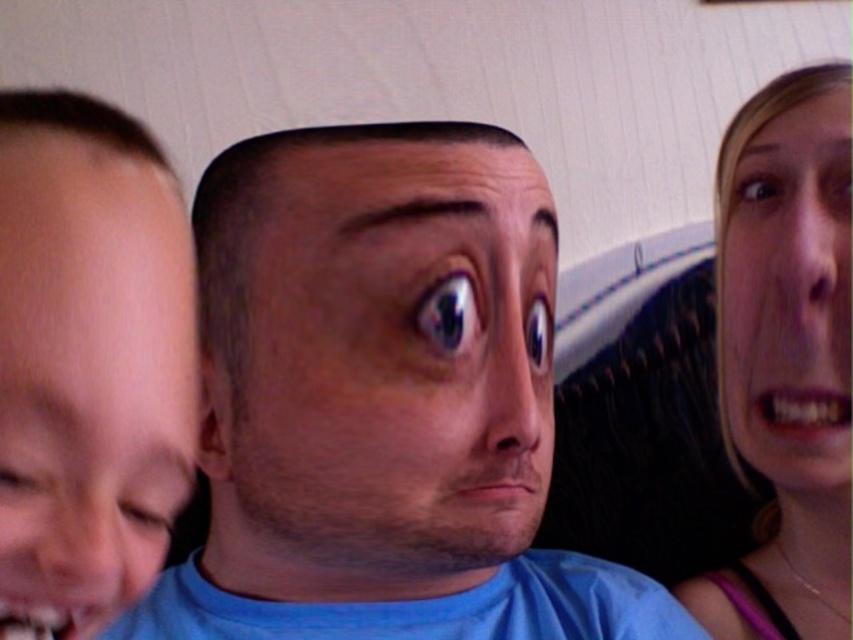
Question: Which point is farther from the camera taking this photo?

Choices:
 (A) (485, 378)
 (B) (808, 413)
 (C) (106, 440)

Answer: (B)

Question: Among these points, which one is nearest to the camera?

Choices:
 (A) (230, 490)
 (B) (573, 323)

Answer: (A)

Question: Is blue matte face at center closer to camera compared to white glossy teeth at lower left?

Choices:
 (A) yes
 (B) no

Answer: (B)

Question: Which object is closer to the camera taking this photo?

Choices:
 (A) blonde hair at right
 (B) brown matte face at center
 (C) blue matte face at center
 (D) smooth skin face at left

Answer: (D)

Question: Considering the relative positions of brown matte face at center and smooth skin face at left in the image provided, where is brown matte face at center located with respect to smooth skin face at left?

Choices:
 (A) right
 (B) left

Answer: (A)

Question: Does blonde hair at upper right have a greater width compared to blonde hair at right?

Choices:
 (A) yes
 (B) no

Answer: (A)